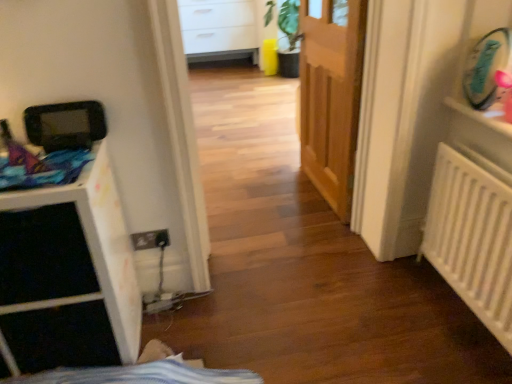
Locate an element on the screen. The image size is (512, 384). free region under white matte radiator at right (from a real-world perspective) is located at coordinates (464, 315).